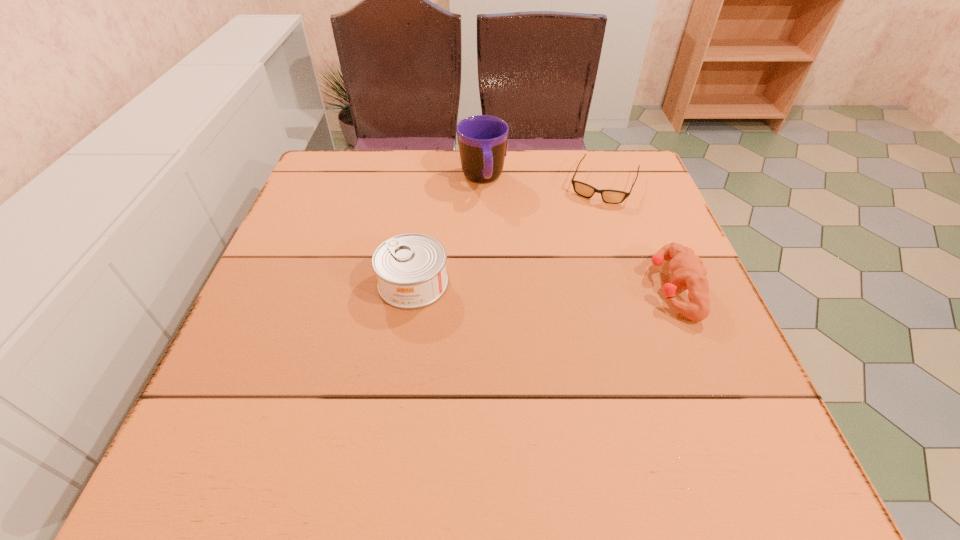
This screenshot has width=960, height=540. I want to click on vacant space located with the handle on the side of the mug, so click(x=502, y=271).

Where is `vacant space located with the handle on the side of the mug`? The height and width of the screenshot is (540, 960). vacant space located with the handle on the side of the mug is located at coordinates (514, 323).

Where is `vacant position located 0.190m on the front-facing side of the sunglasses`? The width and height of the screenshot is (960, 540). vacant position located 0.190m on the front-facing side of the sunglasses is located at coordinates (576, 252).

At what (x,y) coordinates should I click in order to perform the action: click on vacant space located on the front-facing side of the sunglasses. Please return your answer as a coordinate pair (x, y). The width and height of the screenshot is (960, 540). Looking at the image, I should click on (565, 276).

Locate an element on the screen. The image size is (960, 540). free region located on the front-facing side of the sunglasses is located at coordinates (588, 223).

Find the location of a particular element. mug at the far edge is located at coordinates (482, 139).

Locate an element on the screen. The height and width of the screenshot is (540, 960). sunglasses present at the far edge is located at coordinates (585, 190).

Where is `puncher that is at the right edge`? This screenshot has height=540, width=960. puncher that is at the right edge is located at coordinates (688, 272).

Find the location of a particular element. The width and height of the screenshot is (960, 540). sunglasses that is at the right edge is located at coordinates (585, 190).

Locate an element on the screen. This screenshot has height=540, width=960. object at the far right corner is located at coordinates (585, 190).